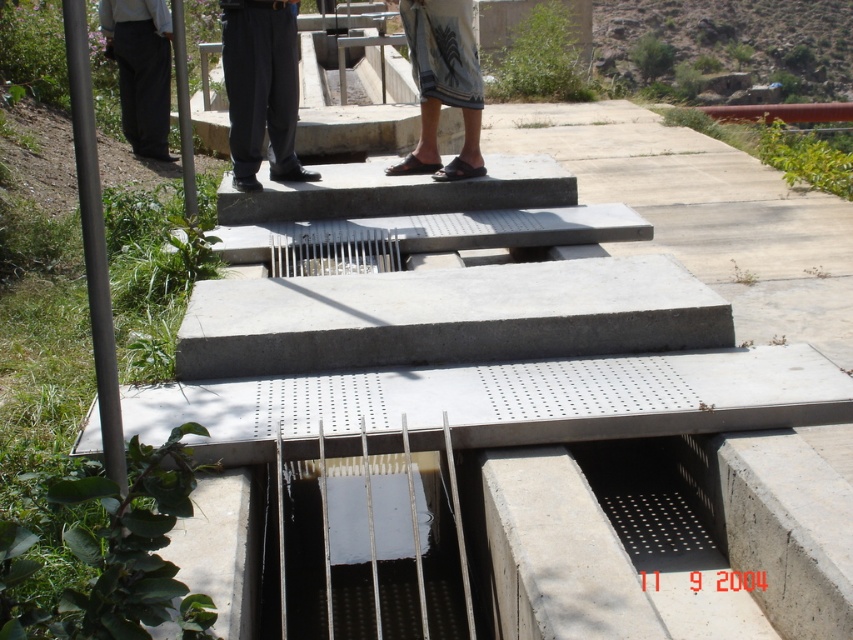
Question: Which object is positioned closest to the white woven cloth at center?

Choices:
 (A) dark gray pants at upper center
 (B) dark gray pants at left

Answer: (A)

Question: Can you confirm if dark gray pants at upper center is thinner than dark gray pants at left?

Choices:
 (A) yes
 (B) no

Answer: (A)

Question: Is dark gray pants at upper center smaller than white woven cloth at center?

Choices:
 (A) yes
 (B) no

Answer: (A)

Question: Which point is closer to the camera?

Choices:
 (A) (274, 45)
 (B) (137, 132)
 (C) (450, 92)

Answer: (A)

Question: Does dark gray pants at upper center have a larger size compared to white woven cloth at center?

Choices:
 (A) no
 (B) yes

Answer: (A)

Question: Which object is the farthest from the white woven cloth at center?

Choices:
 (A) dark gray pants at left
 (B) dark gray pants at upper center

Answer: (A)